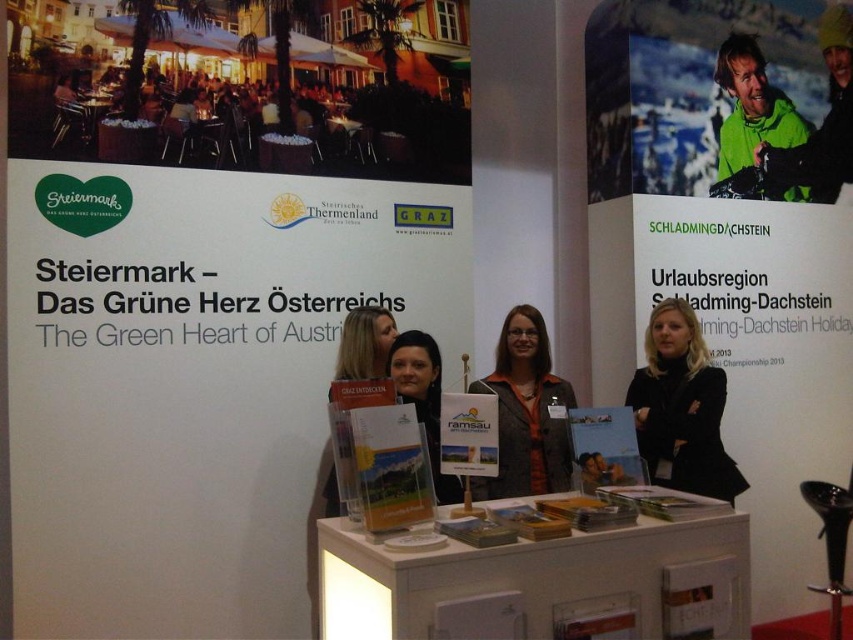
You are standing at the promotional booth for Steiermark. There are two points marked on the booth layout. One is at coordinates point (x=9, y=376) and the other at point (x=720, y=86). Which point is closer to you as you face the booth?

Point (x=9, y=376) is in front of point (x=720, y=86), so it is closer to you as you face the booth.

You are a photographer taking a picture of the booth. You notice the matte brown shirt at center and the matte black hair at center. Which object is positioned higher in the image?

The matte brown shirt at center is taller than the matte black hair at center, so the matte brown shirt at center is positioned higher in the image.

What is located at the coordinates point [526,412]?

At point [526,412] lies matte brown shirt at center.